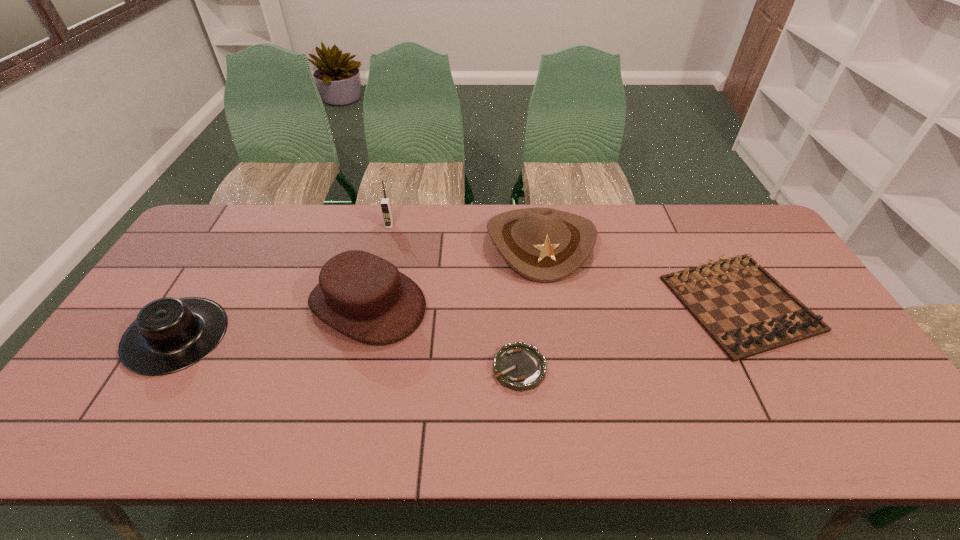
The image size is (960, 540). In order to click on free spot between the cowboy hat and the shortest object in this screenshot , I will do `click(530, 305)`.

Identify the location of vacant space that's between the tallest object and the cowboy hat. (465, 234).

Image resolution: width=960 pixels, height=540 pixels. I want to click on object identified as the third closest to the cowboy hat, so click(519, 366).

This screenshot has width=960, height=540. I want to click on object that stands as the third closest to the right dress hat, so click(385, 203).

I want to click on vacant space that satisfies the following two spatial constraints: 1. on the front-facing side of the tallest object; 2. on the right side of the ashtray, so click(356, 368).

Find the location of `vacant area in the image that satisfies the following two spatial constraints: 1. on the front side of the right dress hat; 2. on the right side of the shortest object`. vacant area in the image that satisfies the following two spatial constraints: 1. on the front side of the right dress hat; 2. on the right side of the shortest object is located at coordinates (352, 368).